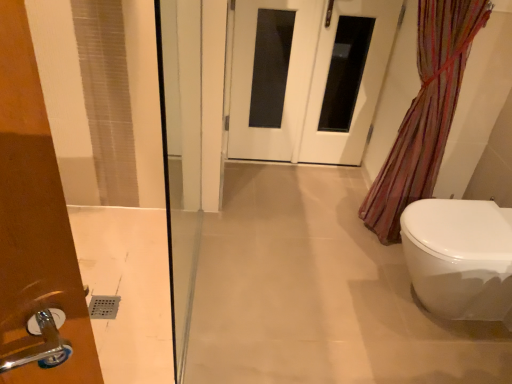
The width and height of the screenshot is (512, 384). I want to click on vacant space underneath white glossy toilet at lower right (from a real-world perspective), so click(424, 310).